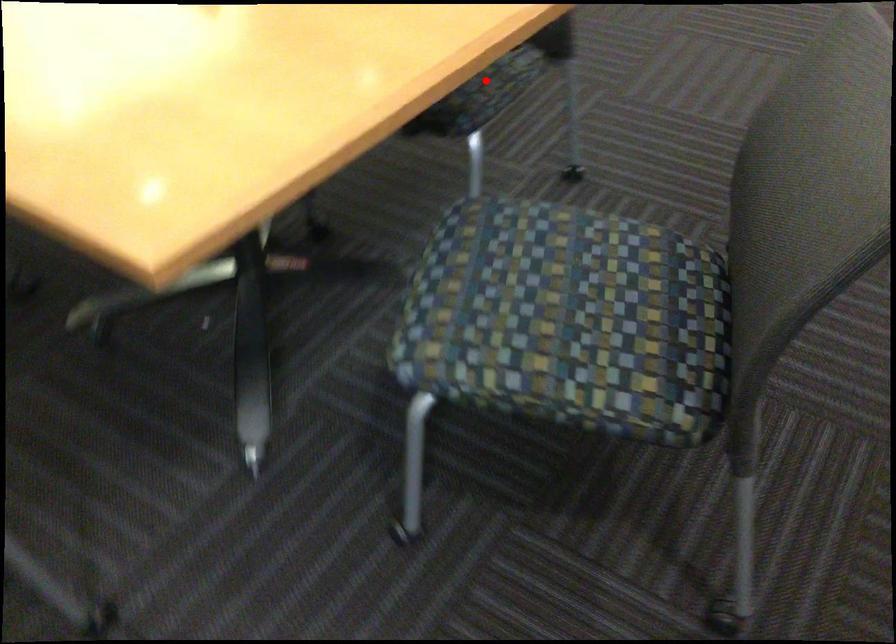
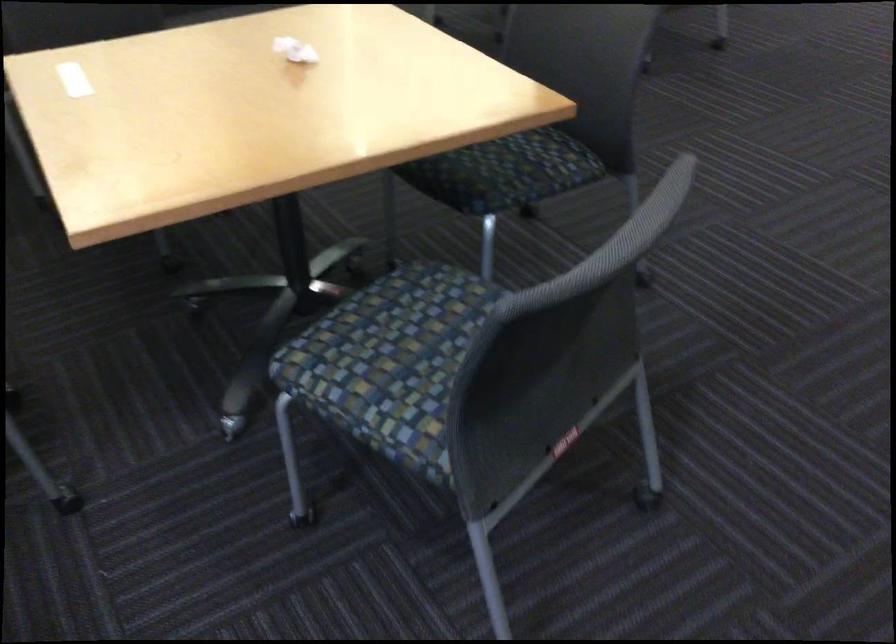
Question: I am providing you with two images of the same scene from different viewpoints. Given a red point in image1, look at the same physical point in image2. Is it:

Choices:
 (A) Closer to the viewpoint
 (B) Farther from the viewpoint

Answer: (B)